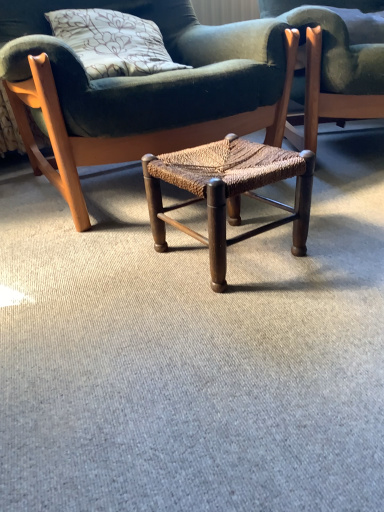
Question: Is woven wood chair at center, arranged as the 1th chair when viewed from the right, thinner than woven wood stool at center?

Choices:
 (A) no
 (B) yes

Answer: (A)

Question: Considering the relative sizes of woven wood chair at center, arranged as the 1th chair when viewed from the right, and woven wood stool at center in the image provided, is woven wood chair at center, arranged as the 1th chair when viewed from the right, bigger than woven wood stool at center?

Choices:
 (A) no
 (B) yes

Answer: (B)

Question: Is woven wood chair at center, arranged as the 1th chair when viewed from the right, oriented away from woven wood stool at center?

Choices:
 (A) yes
 (B) no

Answer: (B)

Question: Does woven wood chair at center, arranged as the 1th chair when viewed from the right, have a greater height compared to woven wood stool at center?

Choices:
 (A) yes
 (B) no

Answer: (A)

Question: Is there a large distance between woven wood chair at center, marked as the second chair in a left-to-right arrangement, and woven wood stool at center?

Choices:
 (A) yes
 (B) no

Answer: (B)

Question: From a real-world perspective, is woven wood stool at center positioned above or below woven wood chair at center, arranged as the 1th chair when viewed from the right?

Choices:
 (A) above
 (B) below

Answer: (B)

Question: Do you think woven wood stool at center is within woven wood chair at center, arranged as the 1th chair when viewed from the right, or outside of it?

Choices:
 (A) inside
 (B) outside

Answer: (B)

Question: Based on their positions, is woven wood stool at center located to the left or right of woven wood chair at center, marked as the second chair in a left-to-right arrangement?

Choices:
 (A) right
 (B) left

Answer: (B)

Question: Is point (215, 151) closer or farther from the camera than point (344, 59)?

Choices:
 (A) closer
 (B) farther

Answer: (A)

Question: From a real-world perspective, is woven wood chair at center, marked as the second chair in a left-to-right arrangement, positioned above or below woven wood stool at center, the second chair from the right?

Choices:
 (A) above
 (B) below

Answer: (B)

Question: Is woven wood chair at center, marked as the second chair in a left-to-right arrangement, bigger or smaller than woven wood stool at center, the second chair from the right?

Choices:
 (A) small
 (B) big

Answer: (A)

Question: Does point (299, 16) appear closer or farther from the camera than point (269, 72)?

Choices:
 (A) closer
 (B) farther

Answer: (B)

Question: Looking at their shapes, would you say woven wood chair at center, marked as the second chair in a left-to-right arrangement, is wider or thinner than woven wood stool at center, the second chair from the right?

Choices:
 (A) thin
 (B) wide

Answer: (B)

Question: From the image's perspective, is woven wood stool at center, the second chair from the right, above or below woven wood stool at center?

Choices:
 (A) below
 (B) above

Answer: (B)

Question: Is woven wood stool at center, the second chair from the right, to the left or to the right of woven wood stool at center in the image?

Choices:
 (A) right
 (B) left

Answer: (B)